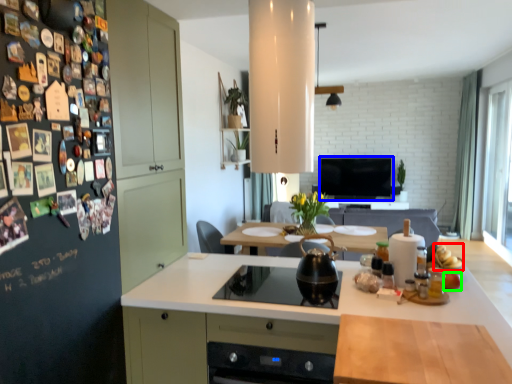
Question: Which is nearer to the food (highlighted by a red box)? television (highlighted by a blue box) or food (highlighted by a green box).

Choices:
 (A) television
 (B) food

Answer: (B)